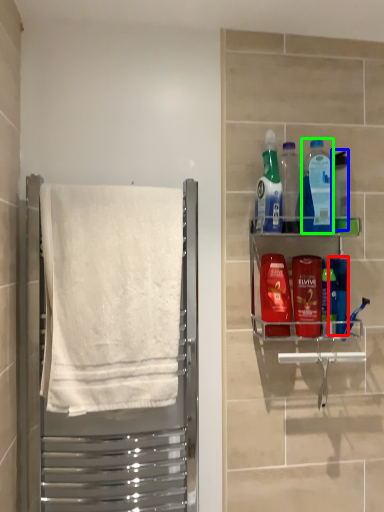
Question: Which is farther away from mouthwash (highlighted by a red box)? bottle (highlighted by a blue box) or cleaning product (highlighted by a green box)?

Choices:
 (A) bottle
 (B) cleaning product

Answer: (A)